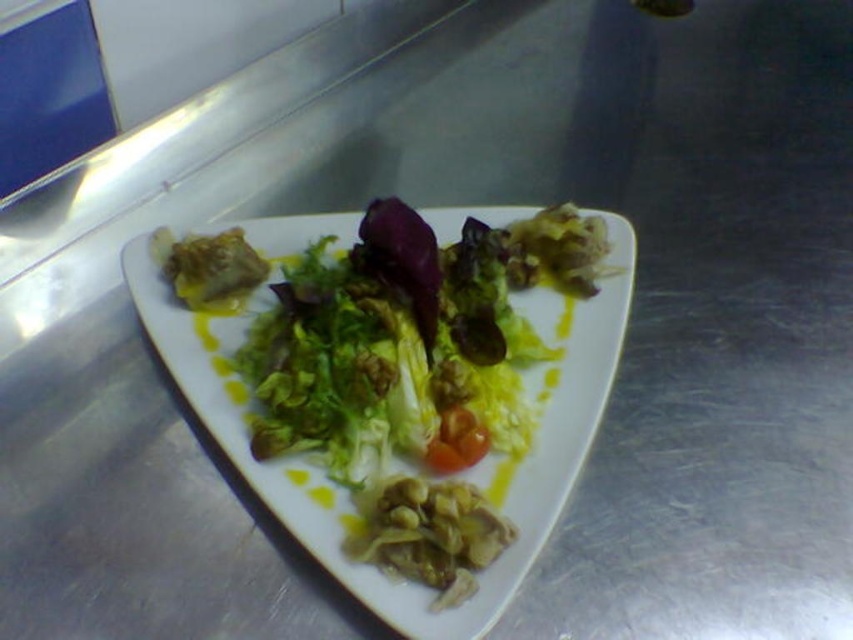
Is white glossy platter at center further to camera compared to glossy red tomato at center?

No, it is not.

Between point (229, 444) and point (442, 428), which one is positioned in front?

Point (229, 444) is in front.

Locate an element on the screen. The width and height of the screenshot is (853, 640). white glossy platter at center is located at coordinates (350, 496).